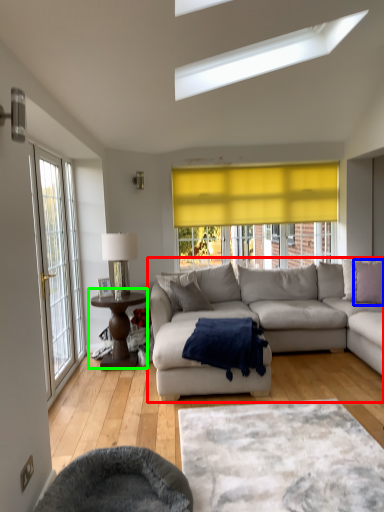
Question: Which object is the closest to the studio couch (highlighted by a red box)? Choose among these: pillow (highlighted by a blue box) or coffee table (highlighted by a green box).

Choices:
 (A) pillow
 (B) coffee table

Answer: (A)